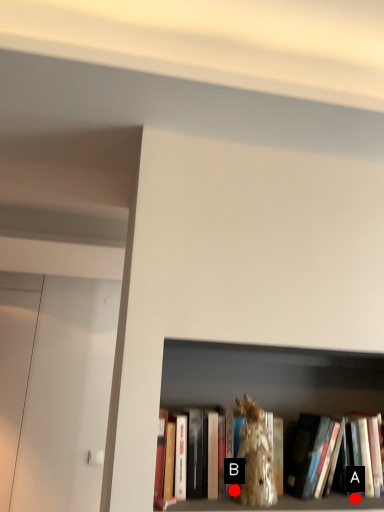
Question: Two points are circled on the image, labeled by A and B beside each circle. Which point is closer to the camera?

Choices:
 (A) A is closer
 (B) B is closer

Answer: (B)